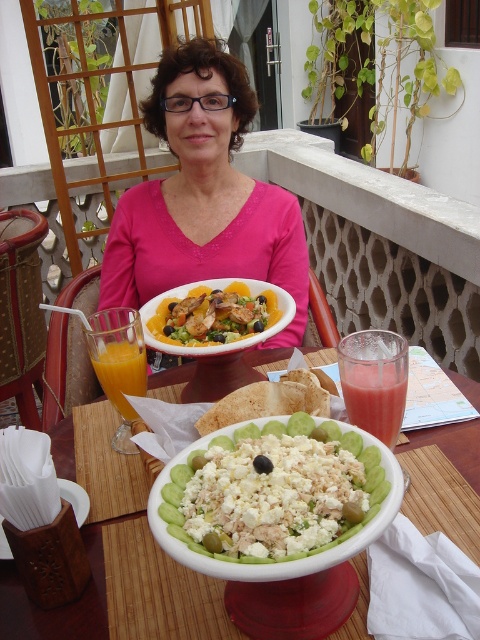
Is orange liquid at left behind wooden tissue box at lower left?

Yes, it is behind wooden tissue box at lower left.

Which is more to the left, orange liquid at left or wooden tissue box at lower left?

wooden tissue box at lower left

Locate an element on the screen. Image resolution: width=480 pixels, height=640 pixels. orange liquid at left is located at coordinates pyautogui.click(x=120, y=372).

Can you confirm if white ceramic bowl at center is positioned above wooden tissue box at lower left?

Indeed, white ceramic bowl at center is positioned over wooden tissue box at lower left.

Between white ceramic bowl at center and wooden tissue box at lower left, which one is positioned higher?

Positioned higher is white ceramic bowl at center.

You are a GUI agent. You are given a task and a screenshot of the screen. Output one action in this format:
    pyautogui.click(x=<x>, y=<y>)
    Task: Click on the white ceramic bowl at center
    This screenshot has width=480, height=640.
    Given the screenshot: What is the action you would take?
    pyautogui.click(x=60, y=605)

What are the coordinates of `white ceramic bowl at center` in the screenshot? It's located at (60, 605).

Who is taller, white crumbly cheese salad at center or wooden tissue box at lower left?

white crumbly cheese salad at center

Based on the photo, is white crumbly cheese salad at center thinner than wooden tissue box at lower left?

No, white crumbly cheese salad at center is not thinner than wooden tissue box at lower left.

Find the location of `white crumbly cheese salad at center`. white crumbly cheese salad at center is located at coordinates (274, 493).